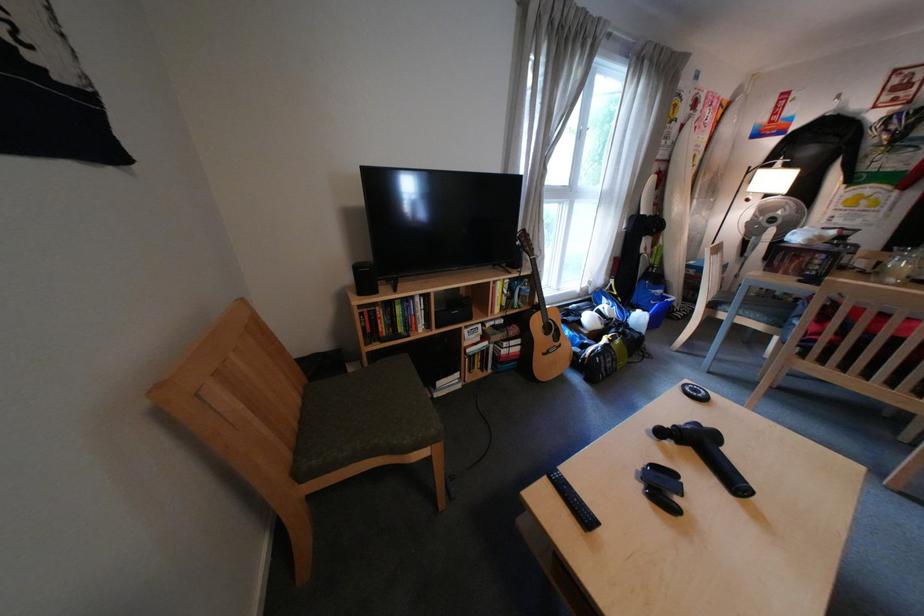
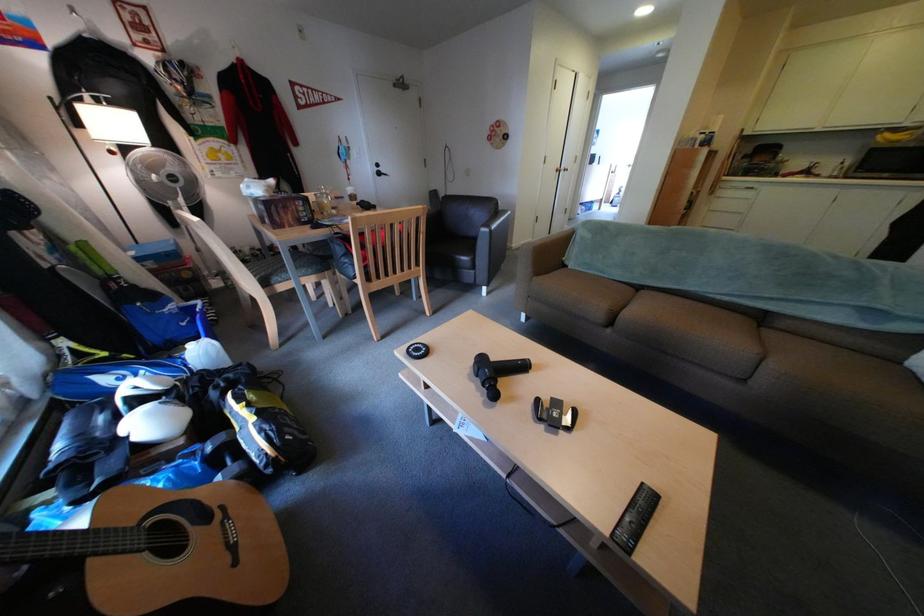
Locate, in the second image, the point that corresponds to point (658, 471) in the first image.

(564, 426)